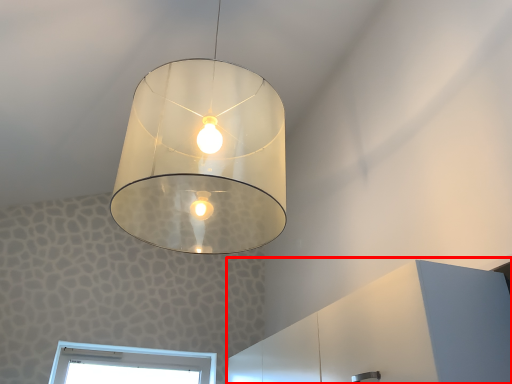
Question: From the image's perspective, what is the correct spatial relationship of dresser (annotated by the red box) in relation to lamp?

Choices:
 (A) below
 (B) above

Answer: (A)